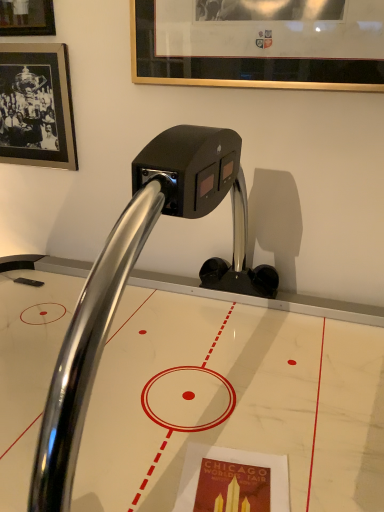
Image resolution: width=384 pixels, height=512 pixels. What do you see at coordinates (128, 277) in the screenshot?
I see `polished chrome faucet at center` at bounding box center [128, 277].

What do you see at coordinates (259, 42) in the screenshot? I see `gold-framed picture at upper center, arranged as the 2th picture frame when viewed from the back` at bounding box center [259, 42].

Image resolution: width=384 pixels, height=512 pixels. What do you see at coordinates (36, 106) in the screenshot?
I see `black matte picture frame at upper left, the 1th picture frame when ordered from left to right` at bounding box center [36, 106].

The image size is (384, 512). Find the location of `polished chrome faucet at center`. polished chrome faucet at center is located at coordinates (128, 277).

Are polished chrome faucet at center and gold-framed picture at upper center, marked as the 2th picture frame in a left-to-right arrangement, making contact?

They are not placed beside each other.

Where is `faucet lying below the gold-framed picture at upper center, which is counted as the 1th picture frame, starting from the front (from the image's perspective)`? Image resolution: width=384 pixels, height=512 pixels. faucet lying below the gold-framed picture at upper center, which is counted as the 1th picture frame, starting from the front (from the image's perspective) is located at coordinates (128, 277).

From the image's perspective, is polished chrome faucet at center above gold-framed picture at upper center, arranged as the 2th picture frame when viewed from the back?

No, from the image's perspective, polished chrome faucet at center is not above gold-framed picture at upper center, arranged as the 2th picture frame when viewed from the back.

Is polished chrome faucet at center looking in the opposite direction of gold-framed picture at upper center, which is counted as the 1th picture frame, starting from the front?

That's not correct — polished chrome faucet at center is not looking away from gold-framed picture at upper center, which is counted as the 1th picture frame, starting from the front.

From a real-world perspective, which is physically below, gold-framed picture at upper center, marked as the 2th picture frame in a left-to-right arrangement, or black matte picture frame at upper left, the 1th picture frame when ordered from left to right?

black matte picture frame at upper left, the 1th picture frame when ordered from left to right, from a real-world perspective.

Is black matte picture frame at upper left, acting as the 2th picture frame starting from the right, surrounded by gold-framed picture at upper center, marked as the 2th picture frame in a left-to-right arrangement?

No, black matte picture frame at upper left, acting as the 2th picture frame starting from the right, is not surrounded by gold-framed picture at upper center, marked as the 2th picture frame in a left-to-right arrangement.

Which point is more forward, (149,29) or (48,53)?

The point (149,29) is more forward.

Is gold-framed picture at upper center, which is the first picture frame in right-to-left order, positioned far away from black matte picture frame at upper left, the 1th picture frame when ordered from left to right?

That's not correct — gold-framed picture at upper center, which is the first picture frame in right-to-left order, is a little close to black matte picture frame at upper left, the 1th picture frame when ordered from left to right.

Does black matte picture frame at upper left, the 1th picture frame when ordered from left to right, turn towards gold-framed picture at upper center, which is counted as the 1th picture frame, starting from the front?

No, black matte picture frame at upper left, the 1th picture frame when ordered from left to right, is not facing towards gold-framed picture at upper center, which is counted as the 1th picture frame, starting from the front.

Which object is positioned more to the left, black matte picture frame at upper left, the first picture frame viewed from the back, or gold-framed picture at upper center, which is counted as the 1th picture frame, starting from the front?

From the viewer's perspective, black matte picture frame at upper left, the first picture frame viewed from the back, appears more on the left side.

In terms of width, does black matte picture frame at upper left, the first picture frame viewed from the back, look wider or thinner when compared to gold-framed picture at upper center, which is the first picture frame in right-to-left order?

Clearly, black matte picture frame at upper left, the first picture frame viewed from the back, has more width compared to gold-framed picture at upper center, which is the first picture frame in right-to-left order.

From the image's perspective, who appears lower, black matte picture frame at upper left, which is the 2th picture frame in front-to-back order, or gold-framed picture at upper center, arranged as the 2th picture frame when viewed from the back?

black matte picture frame at upper left, which is the 2th picture frame in front-to-back order, from the image's perspective.

From the picture: Is polished chrome faucet at center not inside black matte picture frame at upper left, the first picture frame viewed from the back?

polished chrome faucet at center lies outside black matte picture frame at upper left, the first picture frame viewed from the back,'s area.

Which object is further away from the camera taking this photo, polished chrome faucet at center or black matte picture frame at upper left, the 1th picture frame when ordered from left to right?

black matte picture frame at upper left, the 1th picture frame when ordered from left to right, is more distant.

Which is more to the right, polished chrome faucet at center or black matte picture frame at upper left, which is the 2th picture frame in front-to-back order?

polished chrome faucet at center.

From the image's perspective, is gold-framed picture at upper center, marked as the 2th picture frame in a left-to-right arrangement, located above or below polished chrome faucet at center?

Based on their image positions, gold-framed picture at upper center, marked as the 2th picture frame in a left-to-right arrangement, is located above polished chrome faucet at center.

Considering the sizes of gold-framed picture at upper center, which is the first picture frame in right-to-left order, and polished chrome faucet at center in the image, is gold-framed picture at upper center, which is the first picture frame in right-to-left order, bigger or smaller than polished chrome faucet at center?

Considering their sizes, gold-framed picture at upper center, which is the first picture frame in right-to-left order, takes up less space than polished chrome faucet at center.

Visually, is gold-framed picture at upper center, arranged as the 2th picture frame when viewed from the back, positioned to the left or to the right of polished chrome faucet at center?

gold-framed picture at upper center, arranged as the 2th picture frame when viewed from the back, is to the right of polished chrome faucet at center.

Considering their positions, is gold-framed picture at upper center, which is counted as the 1th picture frame, starting from the front, located in front of or behind polished chrome faucet at center?

In the image, gold-framed picture at upper center, which is counted as the 1th picture frame, starting from the front, appears behind polished chrome faucet at center.

Is black matte picture frame at upper left, which is the 2th picture frame in front-to-back order, taller or shorter than polished chrome faucet at center?

In the image, black matte picture frame at upper left, which is the 2th picture frame in front-to-back order, appears to be shorter than polished chrome faucet at center.

Considering the sizes of objects black matte picture frame at upper left, acting as the 2th picture frame starting from the right, and polished chrome faucet at center in the image provided, who is smaller, black matte picture frame at upper left, acting as the 2th picture frame starting from the right, or polished chrome faucet at center?

black matte picture frame at upper left, acting as the 2th picture frame starting from the right.

Between black matte picture frame at upper left, acting as the 2th picture frame starting from the right, and polished chrome faucet at center, which one has larger width?

polished chrome faucet at center.

From a real-world perspective, is black matte picture frame at upper left, acting as the 2th picture frame starting from the right, positioned over polished chrome faucet at center based on gravity?

Correct, in the physical world, black matte picture frame at upper left, acting as the 2th picture frame starting from the right, is higher than polished chrome faucet at center.

I want to click on the 2nd picture frame located above the polished chrome faucet at center (from a real-world perspective), so click(x=259, y=42).

Identify the location of picture frame lying on the left of gold-framed picture at upper center, marked as the 2th picture frame in a left-to-right arrangement. This screenshot has width=384, height=512. (36, 106).

Which object lies nearer to the anchor point black matte picture frame at upper left, the 1th picture frame when ordered from left to right, polished chrome faucet at center or gold-framed picture at upper center, marked as the 2th picture frame in a left-to-right arrangement?

gold-framed picture at upper center, marked as the 2th picture frame in a left-to-right arrangement, is positioned closer to the anchor black matte picture frame at upper left, the 1th picture frame when ordered from left to right.

Considering their positions, is gold-framed picture at upper center, marked as the 2th picture frame in a left-to-right arrangement, positioned further to polished chrome faucet at center than black matte picture frame at upper left, the 1th picture frame when ordered from left to right?

Based on the image, black matte picture frame at upper left, the 1th picture frame when ordered from left to right, appears to be further to polished chrome faucet at center.

Looking at the image, which one is located further to gold-framed picture at upper center, which is counted as the 1th picture frame, starting from the front, black matte picture frame at upper left, the first picture frame viewed from the back, or polished chrome faucet at center?

The object further to gold-framed picture at upper center, which is counted as the 1th picture frame, starting from the front, is polished chrome faucet at center.

From the image, which object appears to be farther from black matte picture frame at upper left, acting as the 2th picture frame starting from the right, gold-framed picture at upper center, marked as the 2th picture frame in a left-to-right arrangement, or polished chrome faucet at center?

polished chrome faucet at center lies further to black matte picture frame at upper left, acting as the 2th picture frame starting from the right, than the other object.

Based on their spatial positions, is polished chrome faucet at center or black matte picture frame at upper left, the 1th picture frame when ordered from left to right, further from gold-framed picture at upper center, which is counted as the 1th picture frame, starting from the front?

polished chrome faucet at center lies further to gold-framed picture at upper center, which is counted as the 1th picture frame, starting from the front, than the other object.

Which object lies nearer to the anchor point polished chrome faucet at center, black matte picture frame at upper left, the 1th picture frame when ordered from left to right, or gold-framed picture at upper center, marked as the 2th picture frame in a left-to-right arrangement?

Based on the image, gold-framed picture at upper center, marked as the 2th picture frame in a left-to-right arrangement, appears to be nearer to polished chrome faucet at center.

This screenshot has height=512, width=384. I want to click on picture frame located between polished chrome faucet at center and black matte picture frame at upper left, the 1th picture frame when ordered from left to right, in the depth direction, so click(x=259, y=42).